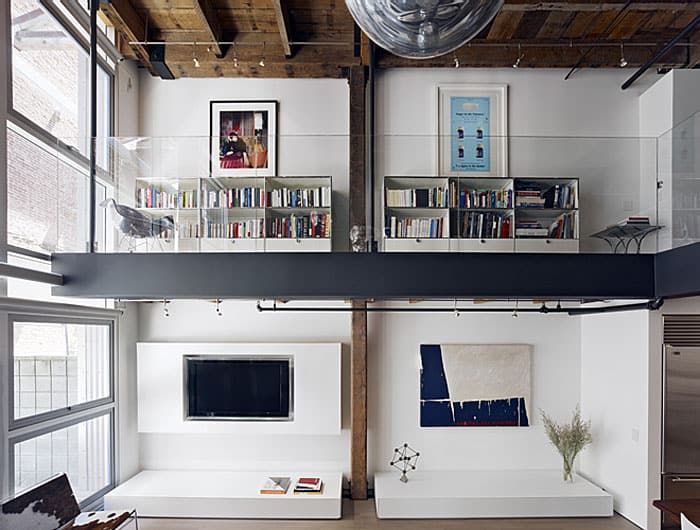
Locate an element on the screen. The height and width of the screenshot is (530, 700). glass is located at coordinates (567, 183).